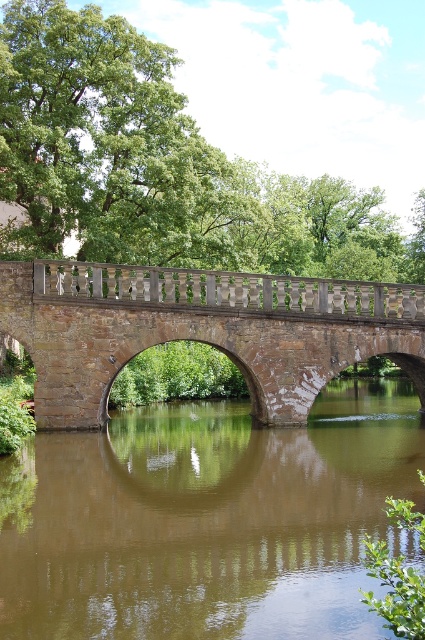
You are standing on the stone bridge and want to locate the brown smooth water at center. According to the coordinates provided, where should you look relative to your position?

The brown smooth water at center is located at coordinates point [207,520], so you should look directly below the bridge towards the center of the water where the coordinates indicate its position.

You are standing at the base of the stone bridge and want to reach a specific point marked as point [325,506]. If your walking speed is 1.5 meters per second, how long will it take you to reach that point?

The distance of point [325,506] from viewer is 32.30 meters. At a speed of 1.5 meters per second, it will take approximately 21.5 seconds to reach the point.